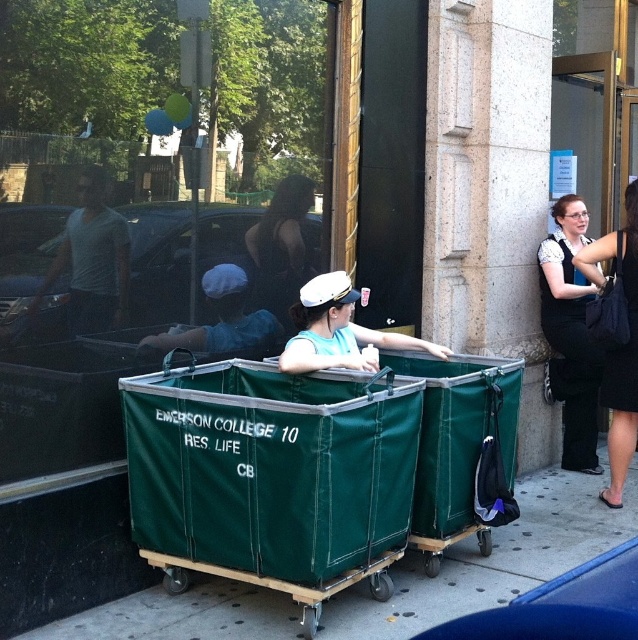
Question: Which of the following is the farthest from the observer?

Choices:
 (A) (226, 298)
 (B) (338, 474)

Answer: (A)

Question: Is white matte shirt at upper left closer to camera compared to blue fabric cart at center?

Choices:
 (A) yes
 (B) no

Answer: (A)

Question: Can you confirm if green fabric cart at center is bigger than black fabric dress at right?

Choices:
 (A) no
 (B) yes

Answer: (B)

Question: Among these objects, which one is nearest to the camera?

Choices:
 (A) matte white cap at center
 (B) white matte cap at center

Answer: (B)

Question: Is matte white cap at center bigger than black fabric bag at right?

Choices:
 (A) yes
 (B) no

Answer: (A)

Question: Which point is closer to the camera?

Choices:
 (A) (352, 472)
 (B) (292, 237)

Answer: (A)